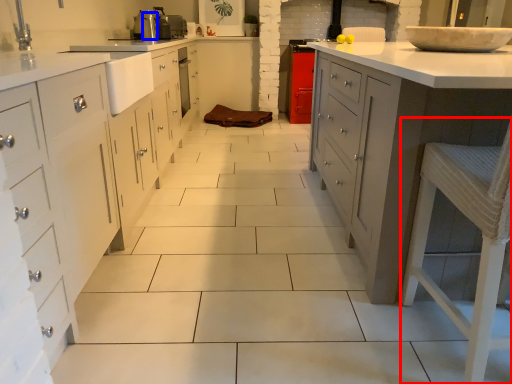
Question: Among these objects, which one is nearest to the camera, bar stool (highlighted by a red box) or appliance (highlighted by a blue box)?

Choices:
 (A) bar stool
 (B) appliance

Answer: (A)